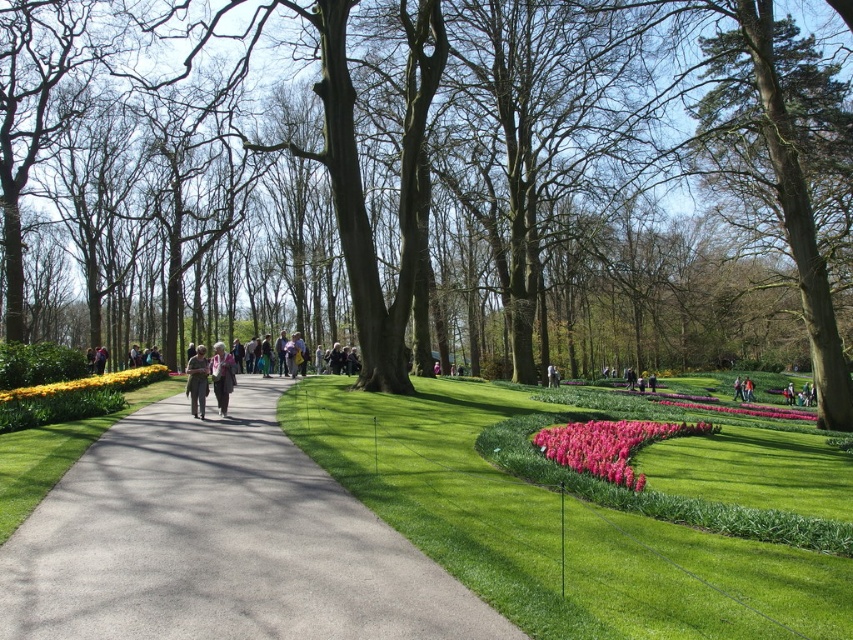
You are a park visitor who wants to walk on the gray asphalt path at center without stepping on the matte gray jacket at center. Since the jacket is on the path, can you walk around it on the path? Explain why.

The gray asphalt path at center has a lesser height compared to matte gray jacket at center, meaning the jacket is placed on top of the path. Since the path is lower than the jacket, you can walk around it on the path as the jacket is elevated above the path surface.

You are a delivery person carrying a light brown leather jacket at center and need to walk along the gray asphalt path at center. Can you walk on the path without the jacket touching the sides?

The gray asphalt path at center is narrower than the light brown leather jacket at center, so you cannot walk on the path without the jacket touching the sides.

You are a gardener who wants to plant new flowers in the park. You have a bag of yellow matte flowers at left and a matte gray jacket at center. Which object takes up more horizontal space?

The matte gray jacket at center takes up more horizontal space than the yellow matte flowers at left because the yellow matte flowers at left are narrower.